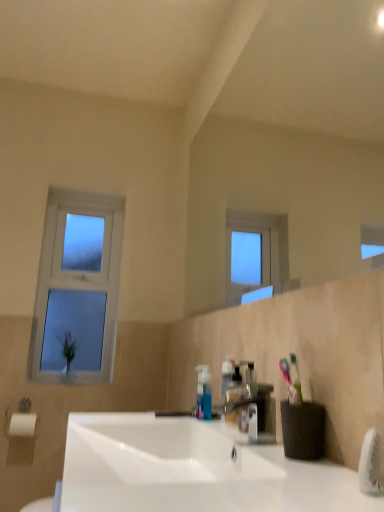
Question: Could you tell me if white glossy sink at center is turned towards clear glass window at left?

Choices:
 (A) no
 (B) yes

Answer: (A)

Question: Are white glossy sink at center and clear glass window at left beside each other?

Choices:
 (A) yes
 (B) no

Answer: (B)

Question: From a real-world perspective, is white glossy sink at center located beneath clear glass window at left?

Choices:
 (A) yes
 (B) no

Answer: (A)

Question: Does white glossy sink at center have a larger size compared to clear glass window at left?

Choices:
 (A) yes
 (B) no

Answer: (A)

Question: Is white glossy sink at center far away from clear glass window at left?

Choices:
 (A) no
 (B) yes

Answer: (B)

Question: Does white glossy sink at center have a lesser height compared to clear glass window at left?

Choices:
 (A) yes
 (B) no

Answer: (A)

Question: Is matte plastic tap at center directly adjacent to clear glass window at left?

Choices:
 (A) no
 (B) yes

Answer: (A)

Question: Is matte plastic tap at center taller than clear glass window at left?

Choices:
 (A) yes
 (B) no

Answer: (B)

Question: Is the position of matte plastic tap at center more distant than that of clear glass window at left?

Choices:
 (A) no
 (B) yes

Answer: (A)

Question: Can you confirm if matte plastic tap at center is bigger than clear glass window at left?

Choices:
 (A) no
 (B) yes

Answer: (A)

Question: Is matte plastic tap at center smaller than clear glass window at left?

Choices:
 (A) yes
 (B) no

Answer: (A)

Question: Is matte plastic tap at center aimed at clear glass window at left?

Choices:
 (A) no
 (B) yes

Answer: (A)

Question: Does clear glass window at left have a larger size compared to matte plastic tap at center?

Choices:
 (A) yes
 (B) no

Answer: (A)